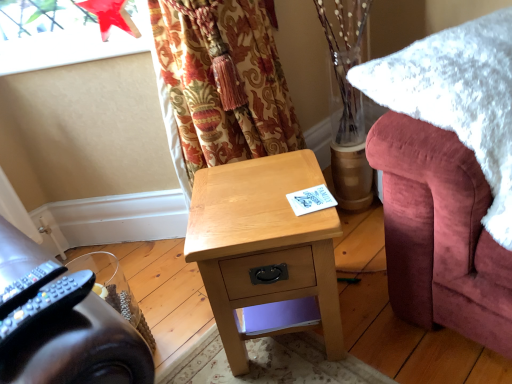
Find the location of a particular element. The image size is (512, 384). white fluffy blanket at right is located at coordinates (458, 98).

In order to face transparent glass window screen at upper left, should I rotate leftwards or rightwards?

You should rotate left by 21.816 degrees.

What is the approximate height of black plastic remote control at lower left, placed as the 1th remote control when sorted from right to left?

2.02 inches.

What do you see at coordinates (46, 305) in the screenshot? Image resolution: width=512 pixels, height=384 pixels. I see `black plastic remote control at lower left, the 2th remote control from the left` at bounding box center [46, 305].

Locate an element on the screen. Image resolution: width=512 pixels, height=384 pixels. white fluffy blanket at right is located at coordinates (458, 98).

Identify the location of the 2nd remote control in front when counting from the white fluffy blanket at right. (46, 305).

Which object is further away from the camera, black plastic remote control at lower left, placed as the 1th remote control when sorted from right to left, or white fluffy blanket at right?

white fluffy blanket at right is behind.

Would you say black plastic remote control at lower left, the 2th remote control from the left, is to the left or to the right of white fluffy blanket at right in the picture?

black plastic remote control at lower left, the 2th remote control from the left, is to the left of white fluffy blanket at right.

Who is taller, black plastic remote control at lower left, placed as the 1th remote control when sorted from right to left, or white fluffy blanket at right?

white fluffy blanket at right is taller.

Can you confirm if black plastic remote control at lower left, which is counted as the 2th remote control, starting from the right, is smaller than light wood desk at center?

Correct, black plastic remote control at lower left, which is counted as the 2th remote control, starting from the right, occupies less space than light wood desk at center.

Based on the photo, between black plastic remote control at lower left, which is counted as the 2th remote control, starting from the right, and light wood desk at center, which one has more height?

Standing taller between the two is light wood desk at center.

Would you say black plastic remote control at lower left, the first remote control from the left, is outside light wood desk at center?

black plastic remote control at lower left, the first remote control from the left, lies outside light wood desk at center's area.

Which is farther, (29,68) or (285,219)?

The point (29,68) is more distant.

Consider the image. Who is taller, transparent glass window screen at upper left or light wood desk at center?

light wood desk at center is taller.

Is transparent glass window screen at upper left positioned with its back to light wood desk at center?

transparent glass window screen at upper left is not turned away from light wood desk at center.

Considering the sizes of objects white fluffy blanket at right and black plastic remote control at lower left, the first remote control from the left, in the image provided, who is bigger, white fluffy blanket at right or black plastic remote control at lower left, the first remote control from the left,?

Bigger between the two is white fluffy blanket at right.

Can you confirm if white fluffy blanket at right is wider than black plastic remote control at lower left, which is counted as the 2th remote control, starting from the right?

Indeed, white fluffy blanket at right has a greater width compared to black plastic remote control at lower left, which is counted as the 2th remote control, starting from the right.

Between white fluffy blanket at right and black plastic remote control at lower left, which is counted as the 2th remote control, starting from the right, which one has less height?

black plastic remote control at lower left, which is counted as the 2th remote control, starting from the right.

Image resolution: width=512 pixels, height=384 pixels. Find the location of `the 1st remote control below the white fluffy blanket at right (from the image's perspective)`. the 1st remote control below the white fluffy blanket at right (from the image's perspective) is located at coordinates (28, 286).

From a real-world perspective, is white fluffy blanket at right located higher than black plastic remote control at lower left, the 2th remote control from the left?

Incorrect, from a real-world perspective, white fluffy blanket at right is lower than black plastic remote control at lower left, the 2th remote control from the left.

From the image's perspective, would you say white fluffy blanket at right is shown under black plastic remote control at lower left, the 2th remote control from the left?

Actually, white fluffy blanket at right appears above black plastic remote control at lower left, the 2th remote control from the left, in the image.

Considering the relative sizes of white fluffy blanket at right and black plastic remote control at lower left, the 2th remote control from the left, in the image provided, is white fluffy blanket at right shorter than black plastic remote control at lower left, the 2th remote control from the left,?

No.

Is black plastic remote control at lower left, the 2th remote control from the left, thinner than black plastic remote control at lower left, the first remote control from the left?

Incorrect, the width of black plastic remote control at lower left, the 2th remote control from the left, is not less than that of black plastic remote control at lower left, the first remote control from the left.

Based on the photo, are black plastic remote control at lower left, placed as the 1th remote control when sorted from right to left, and black plastic remote control at lower left, which is counted as the 2th remote control, starting from the right, located far from each other?

No.

Considering the positions of objects black plastic remote control at lower left, placed as the 1th remote control when sorted from right to left, and black plastic remote control at lower left, which is counted as the 2th remote control, starting from the right, in the image provided, who is in front, black plastic remote control at lower left, placed as the 1th remote control when sorted from right to left, or black plastic remote control at lower left, which is counted as the 2th remote control, starting from the right,?

black plastic remote control at lower left, placed as the 1th remote control when sorted from right to left, is in front.

Which is more to the right, black plastic remote control at lower left, the 2th remote control from the left, or light wood desk at center?

From the viewer's perspective, light wood desk at center appears more on the right side.

From the image's perspective, is black plastic remote control at lower left, placed as the 1th remote control when sorted from right to left, located above or below light wood desk at center?

From the image's perspective, black plastic remote control at lower left, placed as the 1th remote control when sorted from right to left, appears above light wood desk at center.

From a real-world perspective, which object rests below the other?

light wood desk at center, from a real-world perspective.

Considering the sizes of objects black plastic remote control at lower left, placed as the 1th remote control when sorted from right to left, and light wood desk at center in the image provided, who is thinner, black plastic remote control at lower left, placed as the 1th remote control when sorted from right to left, or light wood desk at center?

black plastic remote control at lower left, placed as the 1th remote control when sorted from right to left.

Locate an element on the screen. blanket below the black plastic remote control at lower left, placed as the 1th remote control when sorted from right to left (from a real-world perspective) is located at coordinates (458, 98).

Which remote control is the 1st one when counting from the front of the light wood desk at center? Please provide its 2D coordinates.

[(28, 286)]

Estimate the real-world distances between objects in this image. Which object is further from light wood desk at center, black plastic remote control at lower left, which is counted as the 2th remote control, starting from the right, or white fluffy blanket at right?

Among the two, black plastic remote control at lower left, which is counted as the 2th remote control, starting from the right, is located further to light wood desk at center.

Looking at the image, which one is located further to transparent glass window screen at upper left, black plastic remote control at lower left, which is counted as the 2th remote control, starting from the right, or light wood desk at center?

black plastic remote control at lower left, which is counted as the 2th remote control, starting from the right, is further to transparent glass window screen at upper left.

Based on their spatial positions, is transparent glass window screen at upper left or black plastic remote control at lower left, which is counted as the 2th remote control, starting from the right, further from light wood desk at center?

transparent glass window screen at upper left is further to light wood desk at center.

Considering their positions, is light wood desk at center positioned further to black plastic remote control at lower left, the first remote control from the left, than black plastic remote control at lower left, the 2th remote control from the left?

light wood desk at center is further to black plastic remote control at lower left, the first remote control from the left.

Estimate the real-world distances between objects in this image. Which object is closer to black plastic remote control at lower left, placed as the 1th remote control when sorted from right to left, light wood desk at center or white fluffy blanket at right?

light wood desk at center.

When comparing their distances from white fluffy blanket at right, does transparent glass window screen at upper left or light wood desk at center seem closer?

Among the two, light wood desk at center is located nearer to white fluffy blanket at right.

Considering their positions, is light wood desk at center positioned closer to white fluffy blanket at right than black plastic remote control at lower left, the 2th remote control from the left?

The object closer to white fluffy blanket at right is light wood desk at center.

Looking at the image, which one is located closer to black plastic remote control at lower left, placed as the 1th remote control when sorted from right to left, light wood desk at center or black plastic remote control at lower left, the first remote control from the left?

black plastic remote control at lower left, the first remote control from the left, is closer to black plastic remote control at lower left, placed as the 1th remote control when sorted from right to left.

Image resolution: width=512 pixels, height=384 pixels. Identify the location of desk between transparent glass window screen at upper left and white fluffy blanket at right in the horizontal direction. (264, 253).

Find the location of a particular element. The image size is (512, 384). desk between black plastic remote control at lower left, the first remote control from the left, and white fluffy blanket at right, in the horizontal direction is located at coordinates (264, 253).

You are a GUI agent. You are given a task and a screenshot of the screen. Output one action in this format:
    pyautogui.click(x=<x>, y=<y>)
    Task: Click on the desk situated between black plastic remote control at lower left, the 2th remote control from the left, and white fluffy blanket at right from left to right
    
    Given the screenshot: What is the action you would take?
    pyautogui.click(x=264, y=253)

The width and height of the screenshot is (512, 384). I want to click on remote control between black plastic remote control at lower left, the 2th remote control from the left, and transparent glass window screen at upper left from front to back, so click(x=28, y=286).